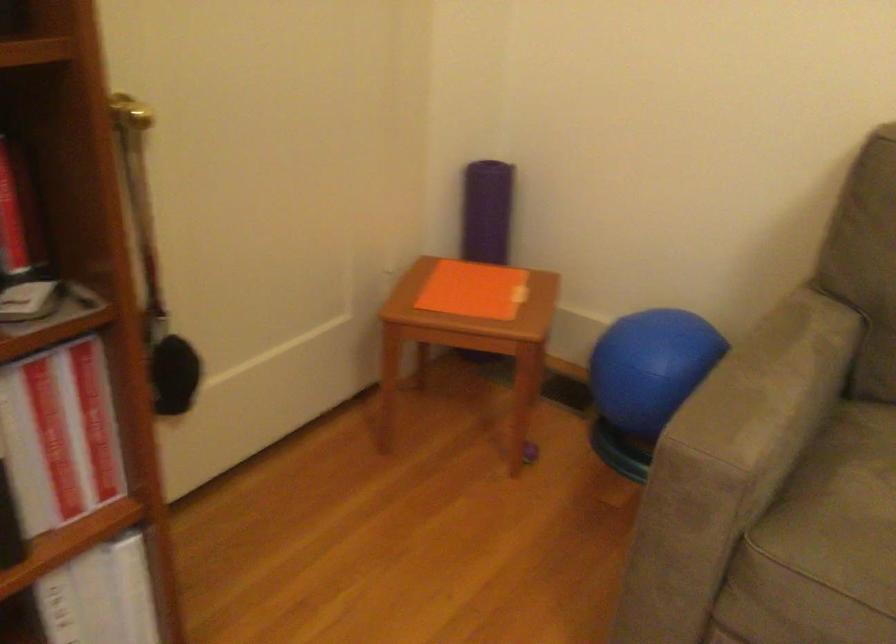
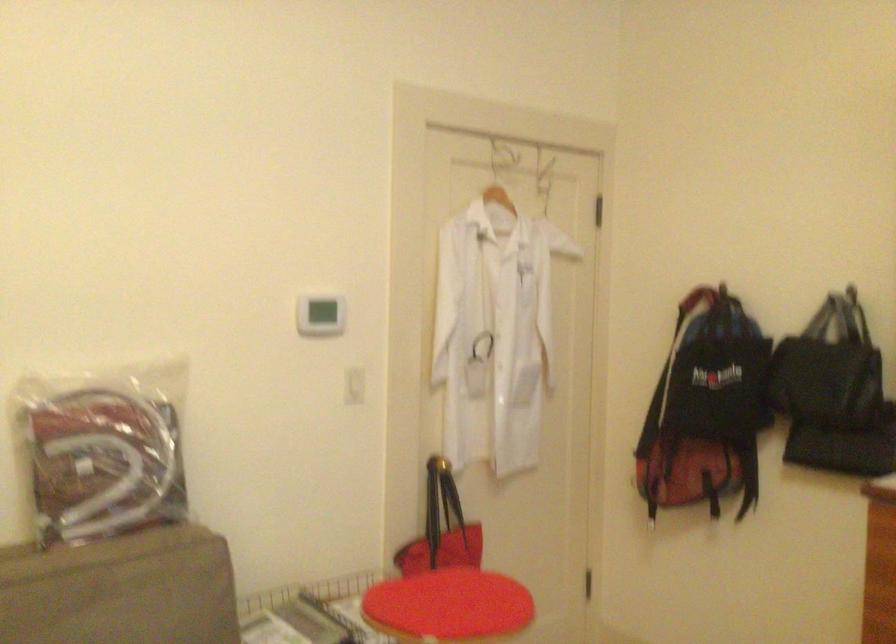
Question: The images are taken continuously from a first-person perspective. In which direction is your viewpoint rotating?

Choices:
 (A) Left
 (B) Right
 (C) Up
 (D) Down

Answer: (B)